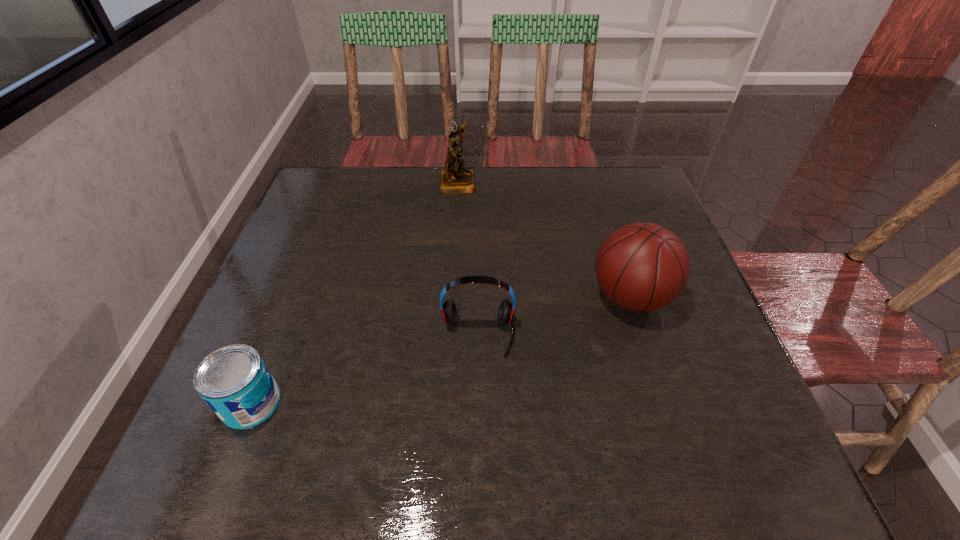
This screenshot has width=960, height=540. What are the coordinates of `vacant space that satisfies the following two spatial constraints: 1. on the front-facing side of the basketball; 2. on the left side of the figurine` in the screenshot? It's located at (451, 296).